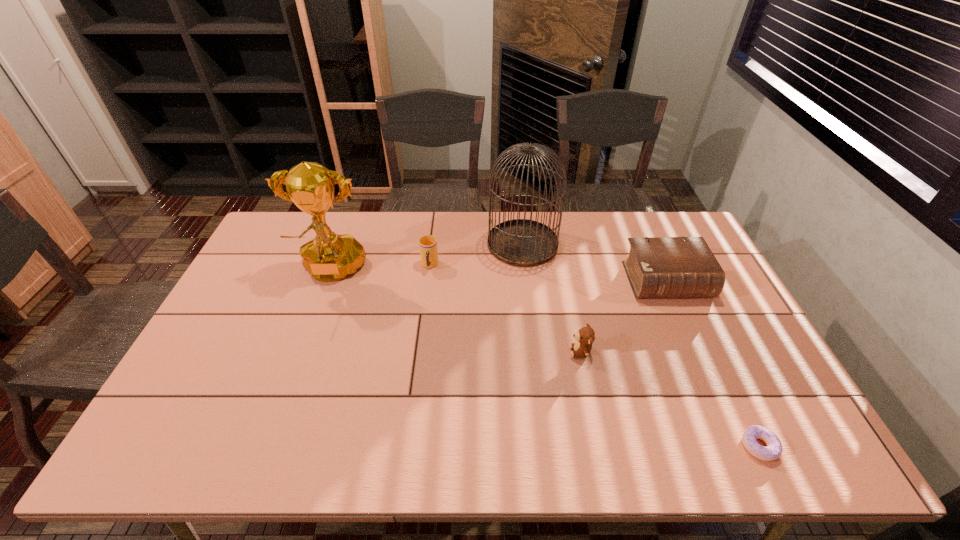
The height and width of the screenshot is (540, 960). In order to click on vacant area that satisfies the following two spatial constraints: 1. on the front side of the birdcage; 2. on the right side of the doughnut in this screenshot , I will do `click(545, 446)`.

This screenshot has width=960, height=540. What are the coordinates of `free location that satisfies the following two spatial constraints: 1. on the back side of the doughnut; 2. on the face of the teddy bear` in the screenshot? It's located at point(713,352).

Find the location of `vacant point that satisfies the following two spatial constraints: 1. on the spine side of the Bible; 2. on the face of the teddy bear`. vacant point that satisfies the following two spatial constraints: 1. on the spine side of the Bible; 2. on the face of the teddy bear is located at coordinates (698, 352).